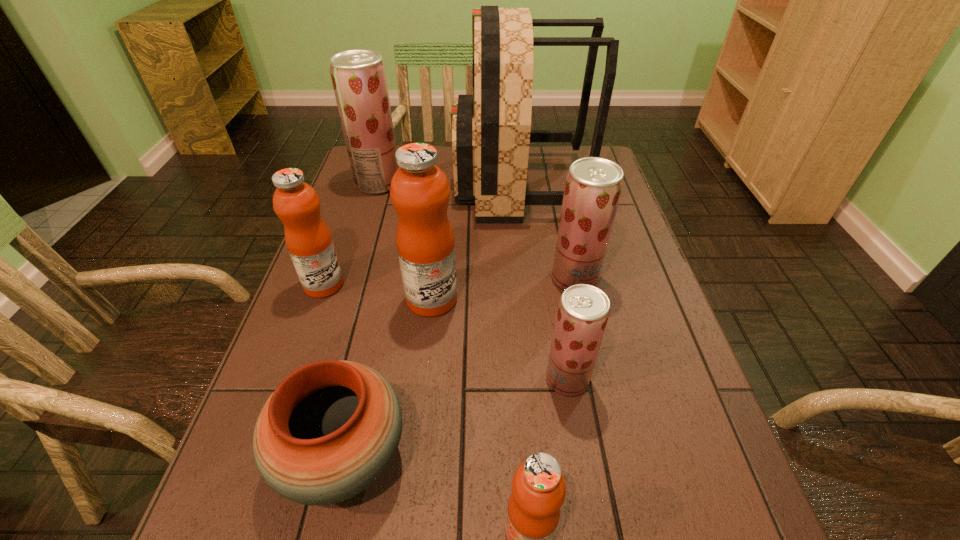
I want to click on backpack located in the far edge section of the desktop, so click(491, 130).

The image size is (960, 540). I want to click on fruit juice that is at the far edge, so click(358, 76).

You are a GUI agent. You are given a task and a screenshot of the screen. Output one action in this format:
    pyautogui.click(x=<x>, y=<y>)
    Task: Click on the pottery that is positioned at the left edge
    The height and width of the screenshot is (540, 960).
    Given the screenshot: What is the action you would take?
    pyautogui.click(x=331, y=428)

Image resolution: width=960 pixels, height=540 pixels. What are the coordinates of `backpack located at the right edge` in the screenshot? It's located at (491, 130).

Find the location of a particular element. fruit juice that is at the right edge is located at coordinates (593, 186).

Image resolution: width=960 pixels, height=540 pixels. I want to click on object situated at the far left corner, so click(x=358, y=76).

You are a GUI agent. You are given a task and a screenshot of the screen. Output one action in this format:
    pyautogui.click(x=<x>, y=<y>)
    Task: Click on the object that is at the far right corner
    Image resolution: width=960 pixels, height=540 pixels.
    Given the screenshot: What is the action you would take?
    pyautogui.click(x=491, y=130)

I want to click on free location at the left edge of the desktop, so click(371, 259).

At what (x,y) coordinates should I click in order to perform the action: click on vacant region at the far right corner of the desktop. Please return your answer as a coordinate pair (x, y). The width and height of the screenshot is (960, 540). Looking at the image, I should click on (554, 146).

Image resolution: width=960 pixels, height=540 pixels. In the image, there is a desktop. Find the location of `vacant space at the near right corner`. vacant space at the near right corner is located at coordinates (680, 538).